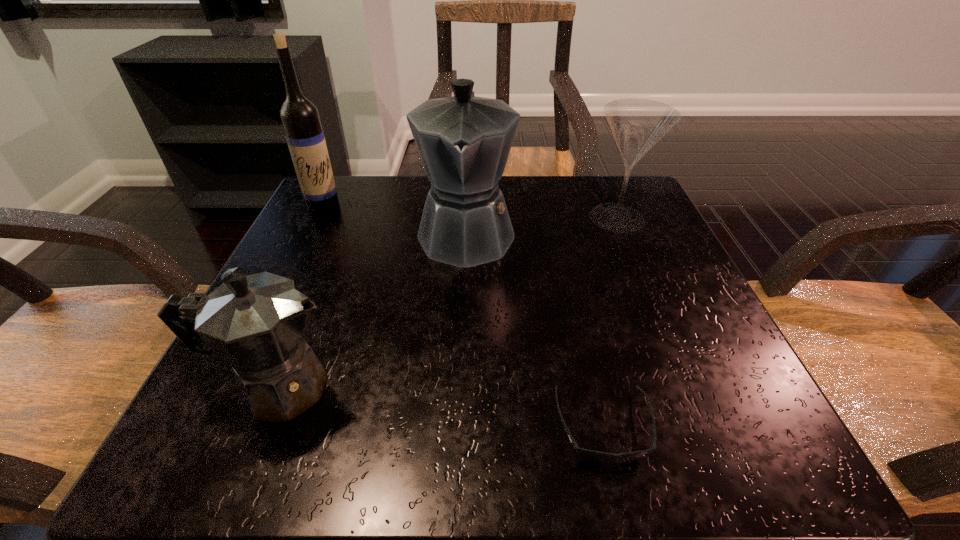
Find the location of a particular element. Image resolution: width=960 pixels, height=540 pixels. vacant area between the wine bottle and the right coffeepot is located at coordinates (396, 220).

In order to click on empty location between the shorter coffeepot and the sunglasses in this screenshot , I will do `click(440, 407)`.

The width and height of the screenshot is (960, 540). I want to click on object that ranks as the third closest to the right coffeepot, so click(x=255, y=324).

Locate an element on the screen. The width and height of the screenshot is (960, 540). the second closest object to the flute glass is located at coordinates click(595, 456).

Locate an element on the screen. Image resolution: width=960 pixels, height=540 pixels. free spot that satisfies the following two spatial constraints: 1. at the spout of the taller coffeepot; 2. on the pouring side of the shorter coffeepot is located at coordinates (460, 387).

I want to click on free location that satisfies the following two spatial constraints: 1. on the label of the rightmost object; 2. on the left side of the wine bottle, so click(320, 218).